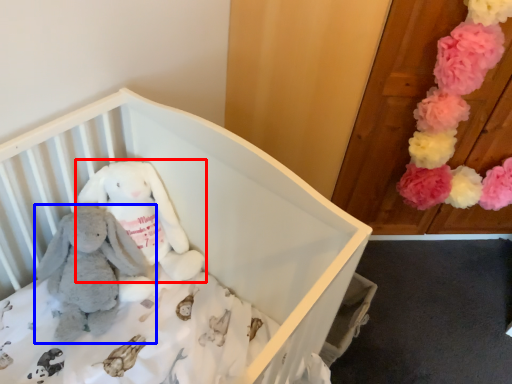
Question: Which object appears closest to the camera in this image, toy (highlighted by a red box) or toy (highlighted by a blue box)?

Choices:
 (A) toy
 (B) toy

Answer: (B)